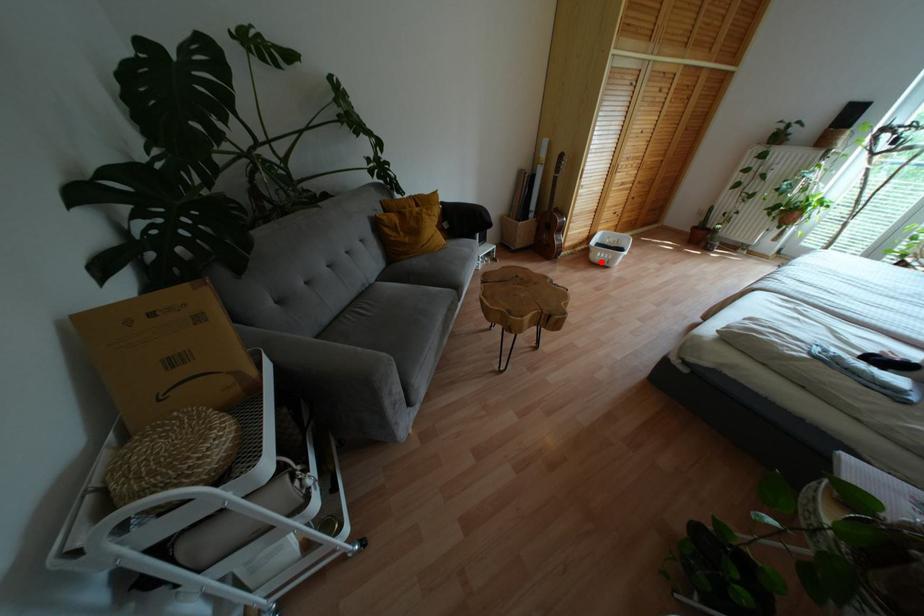
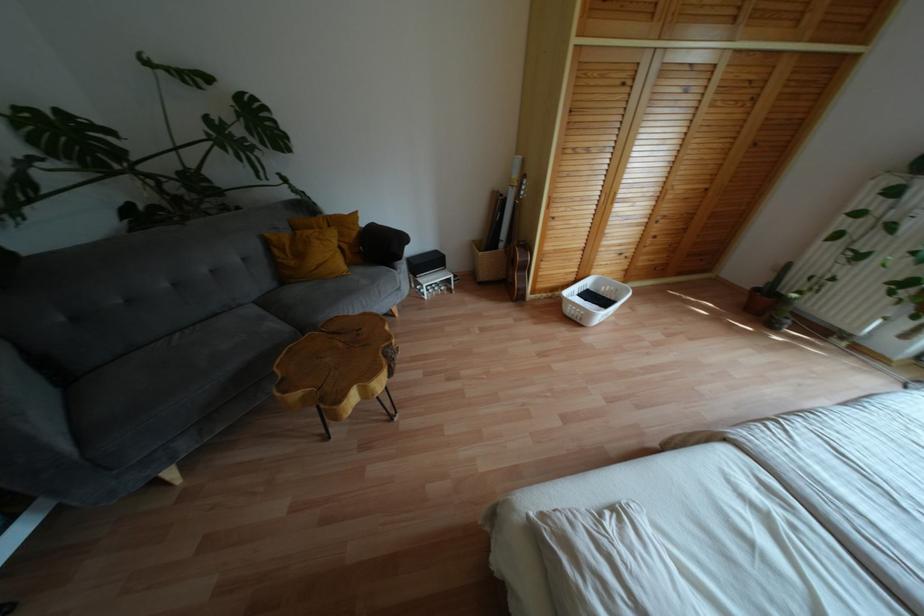
Question: A red point is marked in image1. In image2, is the corresponding 3D point closer to the camera or farther? Reply with the corresponding letter.

Choices:
 (A) The corresponding 3D point is closer.
 (B) The corresponding 3D point is farther.

Answer: (A)